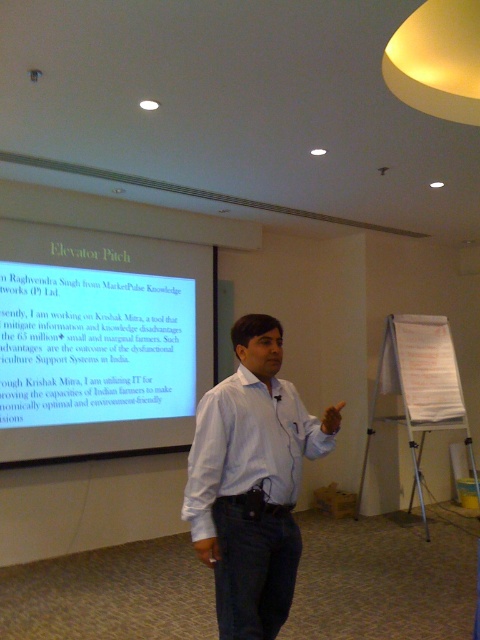
Question: Can you confirm if white glossy projector screen at upper left is bigger than white shirt at center?

Choices:
 (A) no
 (B) yes

Answer: (B)

Question: Does white glossy projector screen at upper left appear on the right side of white shirt at center?

Choices:
 (A) no
 (B) yes

Answer: (A)

Question: Which of the following is the farthest from the observer?

Choices:
 (A) white shirt at center
 (B) white glossy projector screen at upper left

Answer: (B)

Question: Does white glossy projector screen at upper left appear under white shirt at center?

Choices:
 (A) yes
 (B) no

Answer: (B)